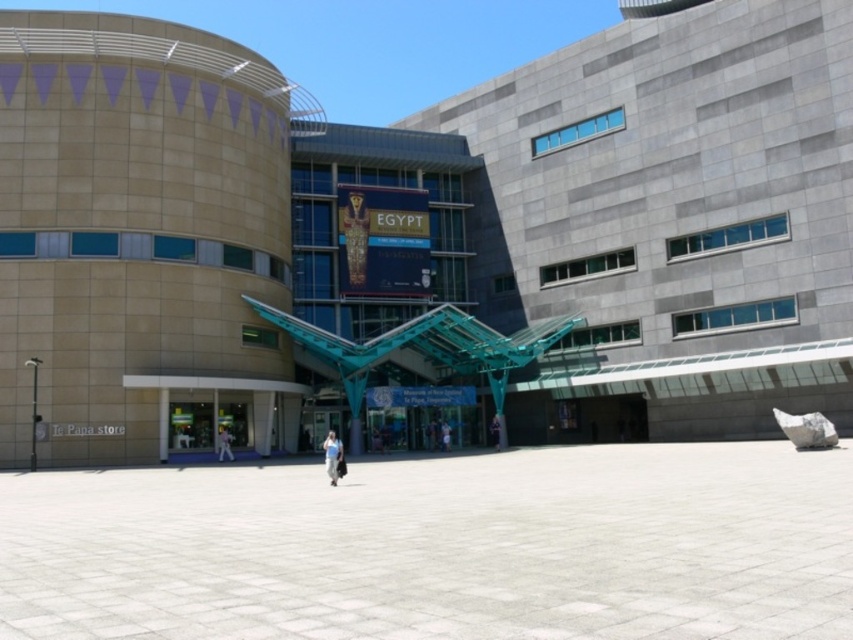
Is beige stone building at center closer to the viewer compared to light blue jeans at center?

No, it is behind light blue jeans at center.

The height and width of the screenshot is (640, 853). Identify the location of beige stone building at center. (422, 236).

At what (x,y) coordinates should I click in order to perform the action: click on beige stone building at center. Please return your answer as a coordinate pair (x, y). This screenshot has height=640, width=853. Looking at the image, I should click on click(422, 236).

Is point (332, 477) less distant than point (498, 445)?

Yes, it is in front of point (498, 445).

Does light blue jeans at center have a smaller size compared to dark blue jeans at center?

Incorrect, light blue jeans at center is not smaller in size than dark blue jeans at center.

Who is more distant from viewer, (329, 468) or (491, 440)?

Positioned behind is point (491, 440).

Where is `light blue jeans at center`? light blue jeans at center is located at coordinates (332, 456).

Does white fabric person at center have a greater height compared to dark blue jeans at center?

In fact, white fabric person at center may be shorter than dark blue jeans at center.

Can you confirm if white fabric person at center is positioned to the right of dark blue jeans at center?

Incorrect, white fabric person at center is not on the right side of dark blue jeans at center.

The image size is (853, 640). What do you see at coordinates (223, 444) in the screenshot? I see `white fabric person at center` at bounding box center [223, 444].

Identify the location of white fabric person at center. (223, 444).